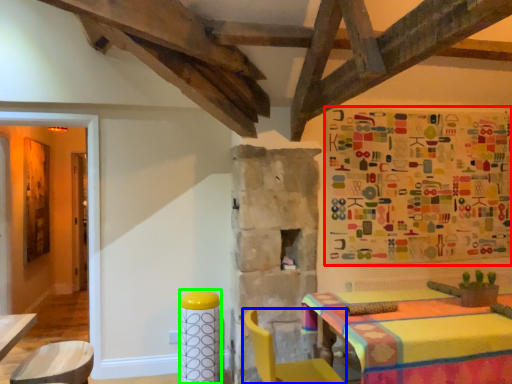
Question: Which is farther away from tapestry (highlighted by a red box)? chair (highlighted by a blue box) or bar stool (highlighted by a green box)?

Choices:
 (A) chair
 (B) bar stool

Answer: (B)